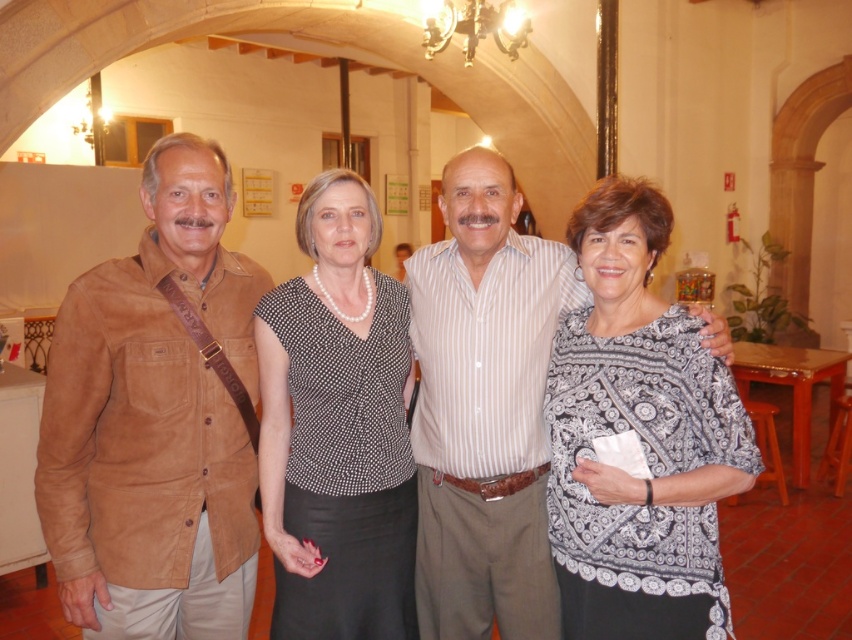
Between suede brown jacket at left and black dotted blouse at center, which one is positioned higher?

suede brown jacket at left is higher up.

Does suede brown jacket at left appear under black dotted blouse at center?

Actually, suede brown jacket at left is above black dotted blouse at center.

You are a GUI agent. You are given a task and a screenshot of the screen. Output one action in this format:
    pyautogui.click(x=<x>, y=<y>)
    Task: Click on the suede brown jacket at left
    This screenshot has height=640, width=852.
    Given the screenshot: What is the action you would take?
    pyautogui.click(x=157, y=419)

You are a GUI agent. You are given a task and a screenshot of the screen. Output one action in this format:
    pyautogui.click(x=<x>, y=<y>)
    Task: Click on the suede brown jacket at left
    
    Given the screenshot: What is the action you would take?
    pyautogui.click(x=157, y=419)

Which is behind, point (173, 227) or point (699, 580)?

Point (173, 227)

Does suede brown jacket at left have a lesser height compared to patterned fabric blouse at right?

No.

Which is behind, point (49, 532) or point (672, 406)?

The point (49, 532) is more distant.

In order to click on suede brown jacket at left in this screenshot , I will do `click(157, 419)`.

Can you confirm if patterned fabric blouse at right is shorter than black dotted blouse at center?

Yes, patterned fabric blouse at right is shorter than black dotted blouse at center.

Is point (695, 456) behind point (314, 216)?

No, it is in front of (314, 216).

Image resolution: width=852 pixels, height=640 pixels. In order to click on patterned fabric blouse at right in this screenshot , I will do `click(639, 438)`.